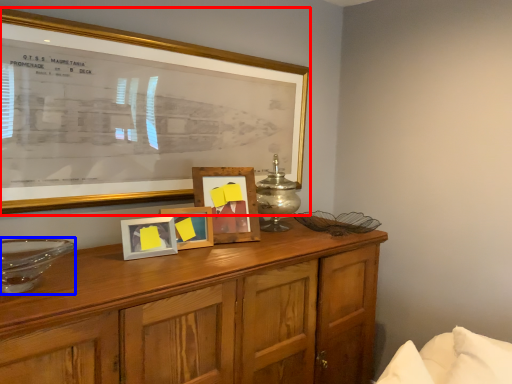
Question: Which object appears farthest to the camera in this image, picture frame (highlighted by a red box) or glass bowl (highlighted by a blue box)?

Choices:
 (A) picture frame
 (B) glass bowl

Answer: (A)